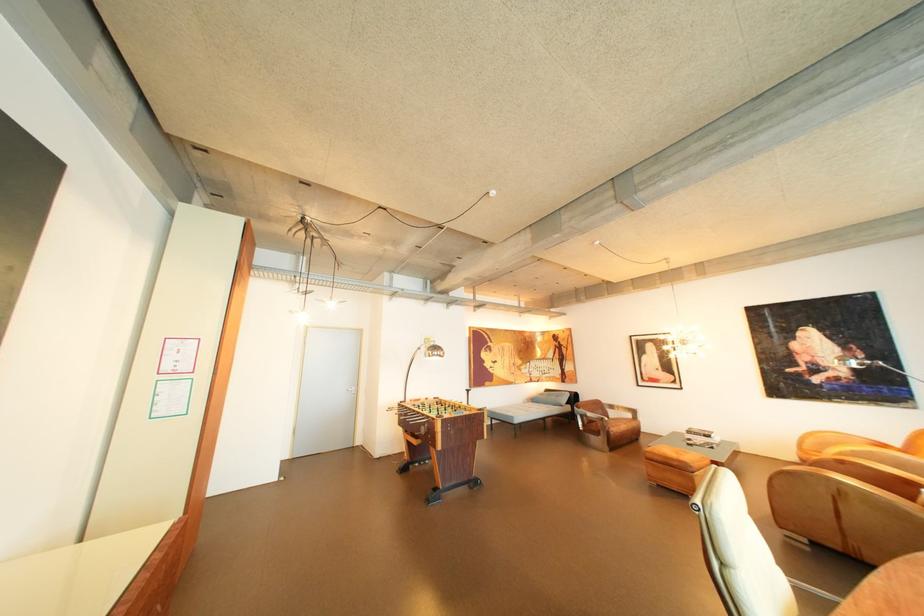
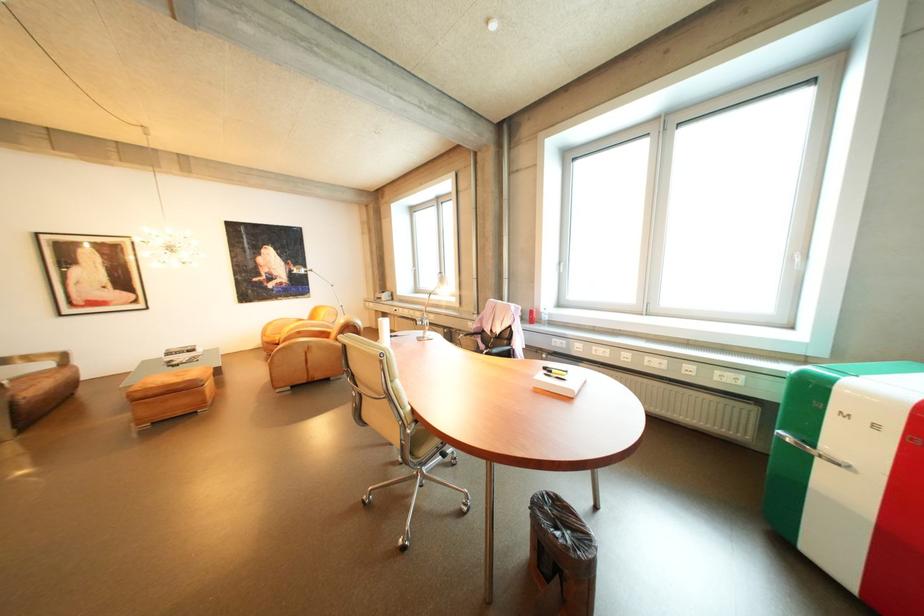
The point at (852,350) is marked in the first image. Where is the corresponding point in the second image?

(296, 264)